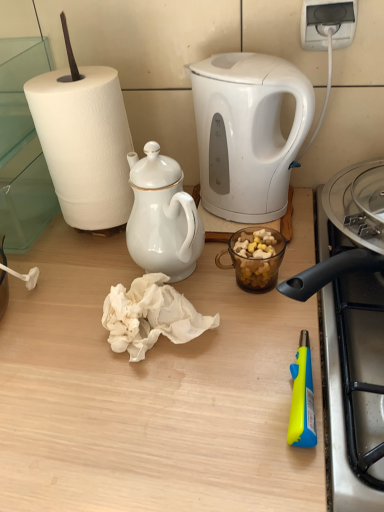
The width and height of the screenshot is (384, 512). Identify the location of vacant space positioned to the left of white crumpled paper towel at center. (47, 334).